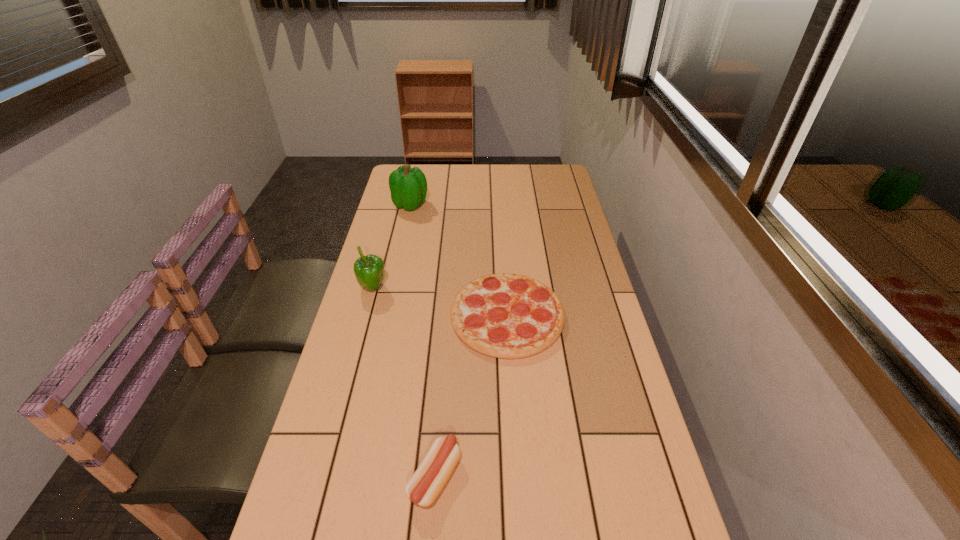
Locate an element on the screen. The height and width of the screenshot is (540, 960). vacant space that satisfies the following two spatial constraints: 1. on the front side of the sausage; 2. on the right side of the nearer bell pepper is located at coordinates (322, 477).